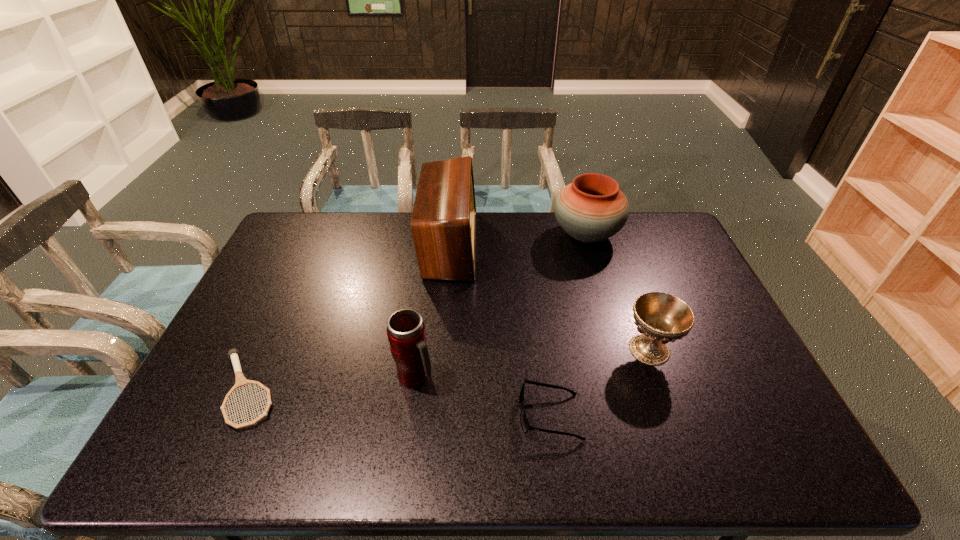
Find the location of a particular element. blank area located on the side with the handle of the thermos bottle is located at coordinates (530, 377).

The image size is (960, 540). Identify the location of free location located 0.250m on the back of the third shortest object. (622, 273).

Where is `vacant area situated on the front-facing side of the fifth tallest object`? The height and width of the screenshot is (540, 960). vacant area situated on the front-facing side of the fifth tallest object is located at coordinates (405, 415).

The height and width of the screenshot is (540, 960). Identify the location of vacant region located 0.070m on the front-facing side of the fifth tallest object. (491, 415).

The image size is (960, 540). What are the coordinates of `vacant space positioned on the front-facing side of the fifth tallest object` in the screenshot? It's located at (499, 415).

This screenshot has height=540, width=960. In order to click on vacant area situated 0.050m on the right of the leftmost object in this screenshot , I will do tap(300, 390).

This screenshot has height=540, width=960. What are the coordinates of `radio receiver that is at the far edge` in the screenshot? It's located at (443, 223).

I want to click on pottery located in the far edge section of the desktop, so click(592, 208).

This screenshot has width=960, height=540. I want to click on object that is at the near edge, so click(524, 422).

Locate an element on the screen. This screenshot has height=540, width=960. object that is at the left edge is located at coordinates 241,381.